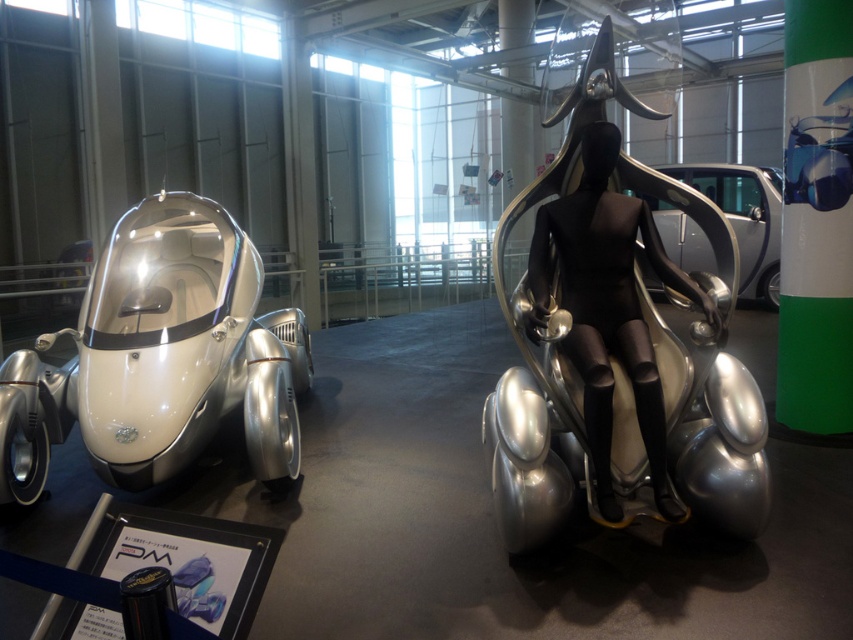
Question: Which of the following is the closest to the observer?

Choices:
 (A) (575, 120)
 (B) (32, 432)

Answer: (A)

Question: Is silver metallic chair at center positioned at the back of silver metallic concept car at left?

Choices:
 (A) no
 (B) yes

Answer: (A)

Question: Can you confirm if silver metallic chair at center is positioned to the left of metallic silver car at center?

Choices:
 (A) no
 (B) yes

Answer: (B)

Question: From the image, what is the correct spatial relationship of silver metallic chair at center in relation to metallic silver car at center?

Choices:
 (A) below
 (B) above

Answer: (A)

Question: Which point appears farthest from the camera in this image?

Choices:
 (A) (654, 410)
 (B) (698, 164)

Answer: (B)

Question: Which point is farther to the camera?

Choices:
 (A) (746, 266)
 (B) (549, 276)

Answer: (A)